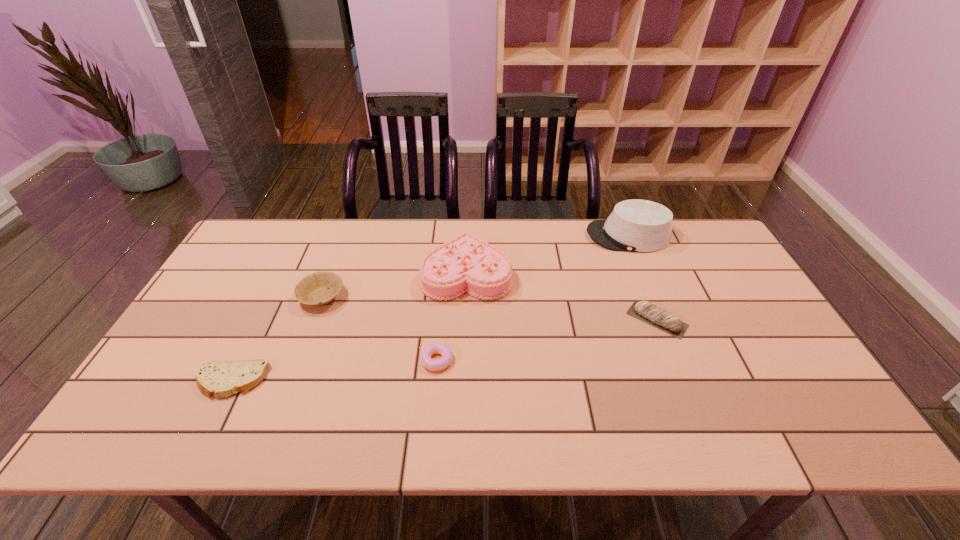
You are a GUI agent. You are given a task and a screenshot of the screen. Output one action in this format:
    pyautogui.click(x=<x>, y=<y>)
    Task: Click on the free space that satisfies the following two spatial constraints: 1. on the front-facing side of the tallest object; 2. on the front side of the taller pita bread
    
    Given the screenshot: What is the action you would take?
    pyautogui.click(x=663, y=320)

I want to click on vacant area in the image that satisfies the following two spatial constraints: 1. on the back side of the farther pita bread; 2. on the right side of the left pita bread, so click(x=262, y=320).